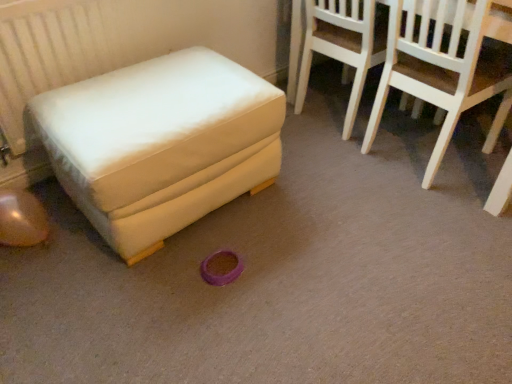
Question: Is white fabric ottoman at left not close to white wood chair at upper right, acting as the first chair starting from the right?

Choices:
 (A) no
 (B) yes

Answer: (A)

Question: Considering the relative sizes of white fabric ottoman at left and white wood chair at upper right, the second chair from the left, in the image provided, is white fabric ottoman at left shorter than white wood chair at upper right, the second chair from the left,?

Choices:
 (A) yes
 (B) no

Answer: (A)

Question: Is white fabric ottoman at left aimed at white wood chair at upper right, acting as the first chair starting from the right?

Choices:
 (A) yes
 (B) no

Answer: (B)

Question: From a real-world perspective, is white fabric ottoman at left below white wood chair at upper right, the second chair from the left?

Choices:
 (A) yes
 (B) no

Answer: (A)

Question: Does white fabric ottoman at left have a greater width compared to white wood chair at upper right, the second chair from the left?

Choices:
 (A) no
 (B) yes

Answer: (B)

Question: From a real-world perspective, is white wood chair at upper right, acting as the first chair starting from the right, above or below light wood chair at upper right, positioned as the first chair in left-to-right order?

Choices:
 (A) above
 (B) below

Answer: (A)

Question: Is white wood chair at upper right, acting as the first chair starting from the right, wider or thinner than light wood chair at upper right, the 2th chair in the right-to-left sequence?

Choices:
 (A) wide
 (B) thin

Answer: (B)

Question: Considering the positions of white wood chair at upper right, the second chair from the left, and light wood chair at upper right, positioned as the first chair in left-to-right order, in the image, is white wood chair at upper right, the second chair from the left, taller or shorter than light wood chair at upper right, positioned as the first chair in left-to-right order,?

Choices:
 (A) tall
 (B) short

Answer: (A)

Question: In terms of size, does white wood chair at upper right, the second chair from the left, appear bigger or smaller than light wood chair at upper right, the 2th chair in the right-to-left sequence?

Choices:
 (A) big
 (B) small

Answer: (A)

Question: Is point (157, 64) positioned closer to the camera than point (397, 82)?

Choices:
 (A) closer
 (B) farther

Answer: (A)

Question: From a real-world perspective, is white fabric ottoman at left physically located above or below white wood chair at upper right, the second chair from the left?

Choices:
 (A) above
 (B) below

Answer: (B)

Question: Based on their positions, is white fabric ottoman at left located to the left or right of white wood chair at upper right, the second chair from the left?

Choices:
 (A) left
 (B) right

Answer: (A)

Question: Is white fabric ottoman at left in front of or behind white wood chair at upper right, the second chair from the left, in the image?

Choices:
 (A) front
 (B) behind

Answer: (A)

Question: Is point click(364, 56) positioned closer to the camera than point click(430, 57)?

Choices:
 (A) farther
 (B) closer

Answer: (A)

Question: In the image, is light wood chair at upper right, the 2th chair in the right-to-left sequence, positioned in front of or behind white wood chair at upper right, acting as the first chair starting from the right?

Choices:
 (A) front
 (B) behind

Answer: (B)